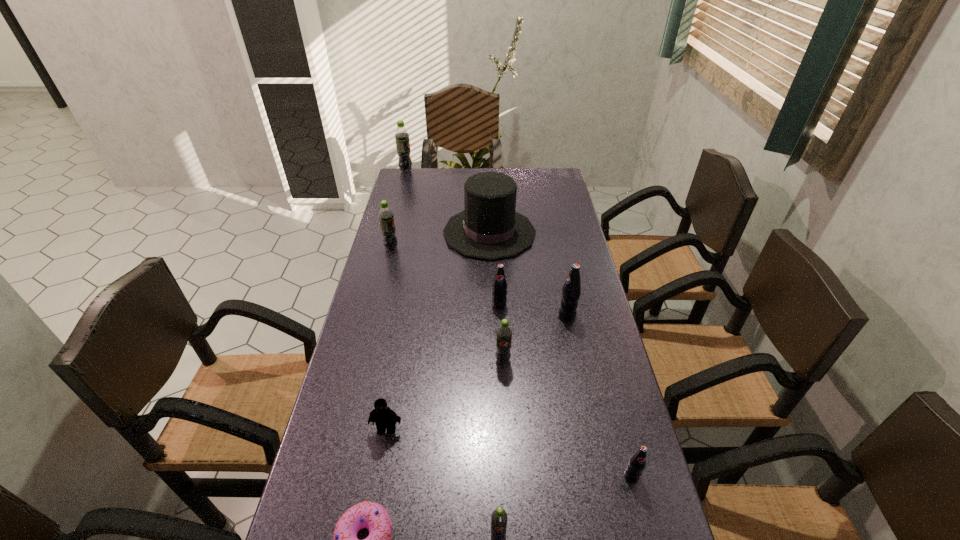
Where is `the tallest soda`? the tallest soda is located at coordinates (401, 135).

At what (x,y) coordinates should I click in order to perform the action: click on the biggest green soda. Please return your answer as a coordinate pair (x, y). The width and height of the screenshot is (960, 540). Looking at the image, I should click on (401, 135).

Identify the location of purple dress hat. (489, 228).

This screenshot has height=540, width=960. I want to click on the second farthest soda, so click(x=386, y=217).

Find the location of a particular element. This screenshot has height=540, width=960. the third smallest green soda is located at coordinates (386, 217).

I want to click on the biggest black pop, so click(x=571, y=290).

The image size is (960, 540). I want to click on the ninth object from left to right, so click(x=571, y=290).

This screenshot has height=540, width=960. Identify the location of the second smallest black pop. (499, 299).

This screenshot has width=960, height=540. What are the coordinates of `the third biggest green soda` in the screenshot? It's located at (504, 333).

Find the location of a particular element. The image size is (960, 540). the fifth nearest object is located at coordinates (504, 333).